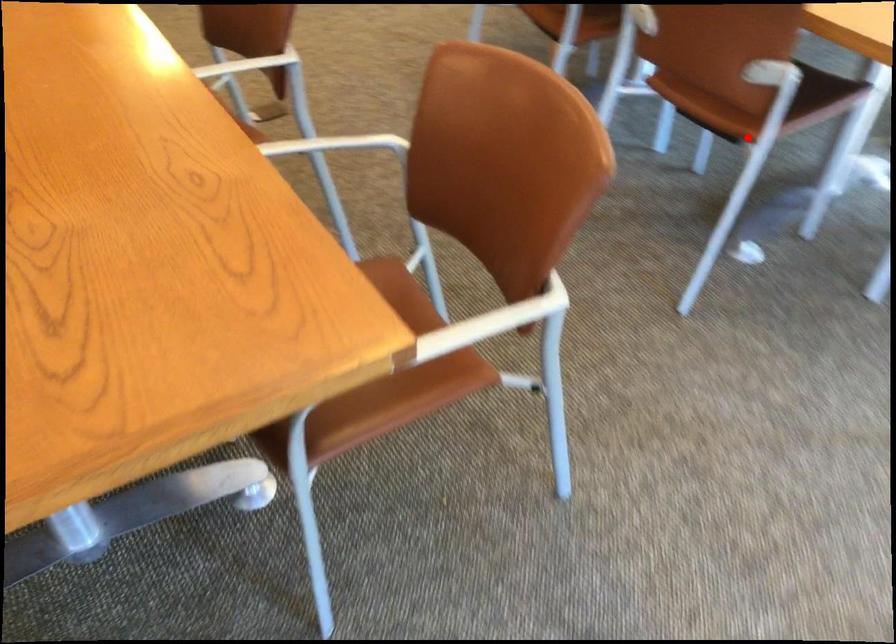
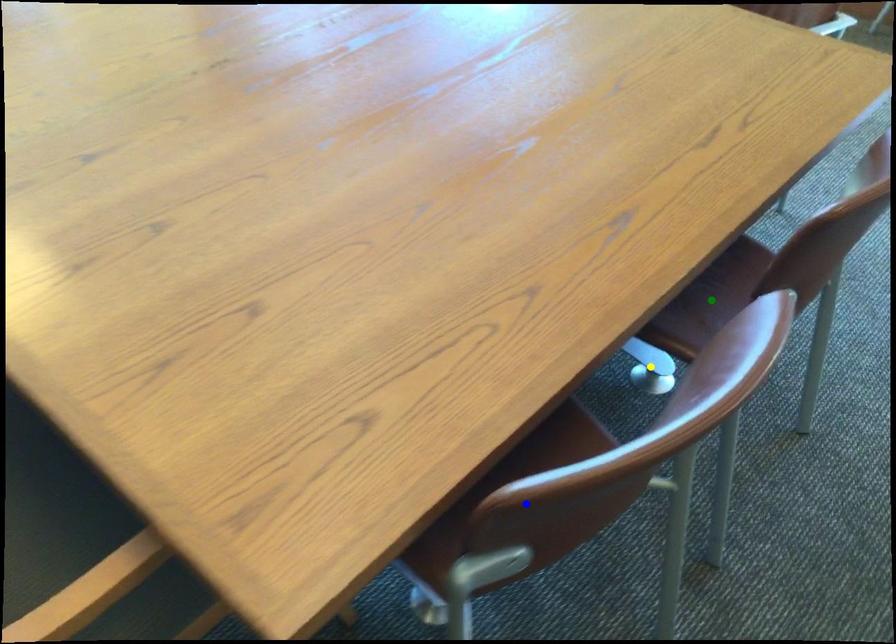
Question: I am providing you with two images of the same scene from different viewpoints. A red point is marked on the first image. You are given multiple points on the second image. Which point in image 2 is actually the same real-world point as the red point in image 1?

Choices:
 (A) blue point
 (B) yellow point
 (C) green point

Answer: (C)